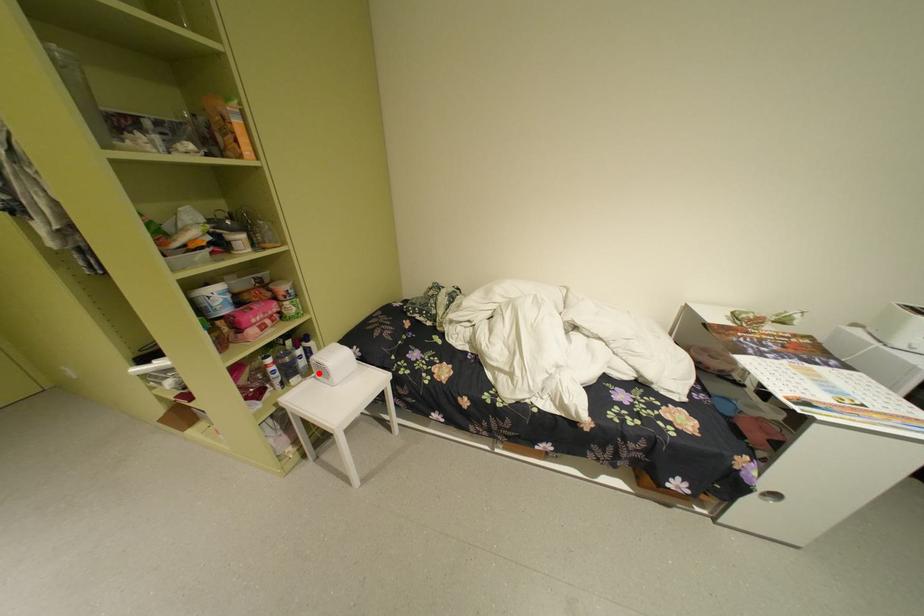
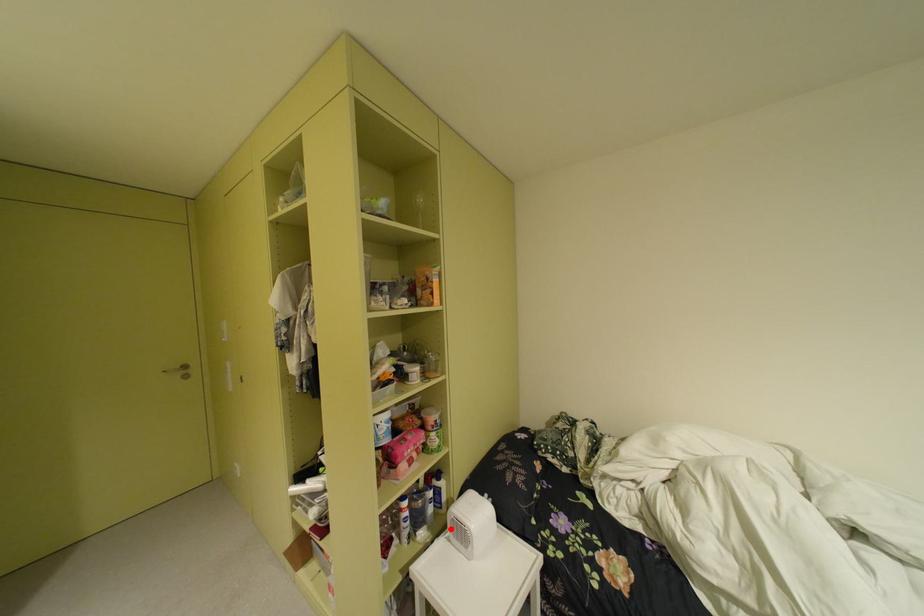
Looking at this image, I am providing you with two images of the same scene from different viewpoints. A red point is marked on the first image and another point is marked on the second image. Is the red point in image1 aligned with the point shown in image2?

Yes